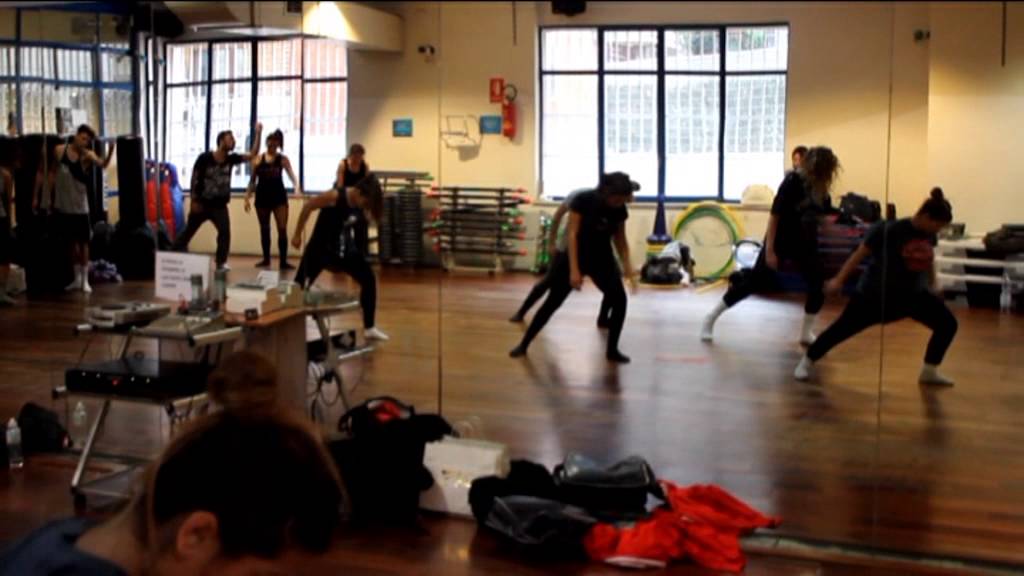
Where is `sock`? sock is located at coordinates (710, 314), (805, 316), (807, 360), (939, 378), (369, 325), (281, 249), (262, 241), (85, 275), (74, 272), (8, 297).